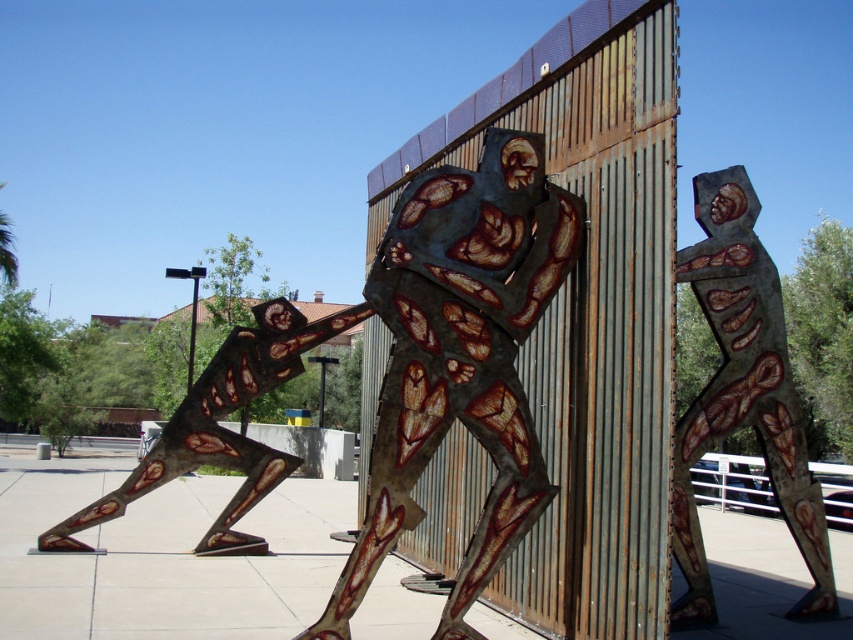
You are an art student observing the two rusty metal figures. Which figure is closer to you, the rusty metal figure at center or the rusty metal figure at upper right?

The rusty metal figure at center is closer to you because it is in front of the rusty metal figure at upper right.

You are an art student analyzing the two rusty metal figures in the park. Which figure is shorter between the rusty metal figure at center and the rusty metal figure at upper right?

The rusty metal figure at center is shorter than the rusty metal figure at upper right.

You are an art student visiting the park and see the two rusty metal figures. You want to take a photo of both rusty metal figure at center and rusty metal figure at upper right in the same frame. Which direction should you move to ensure both are visible?

Move to the left so that both the rusty metal figure at center and the rusty metal figure at upper right come into view, as the rusty metal figure at center is to the left of the rusty metal figure at upper right.